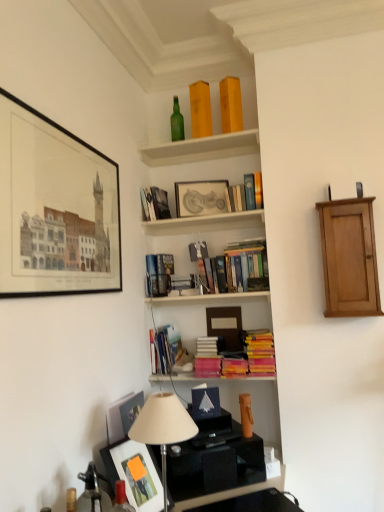
Question: Is matte yellow book at upper center, which ranks as the tenth book in bottom-to-top order, thinner than hardcover books at center, placed as the 1th book when sorted from bottom to top?

Choices:
 (A) yes
 (B) no

Answer: (A)

Question: Is matte yellow book at upper center, placed as the 1th book when sorted from top to bottom, to the left of hardcover books at center, placed as the tenth book when sorted from top to bottom, from the viewer's perspective?

Choices:
 (A) no
 (B) yes

Answer: (A)

Question: From the image's perspective, does matte yellow book at upper center, which ranks as the tenth book in bottom-to-top order, appear higher than hardcover books at center, placed as the tenth book when sorted from top to bottom?

Choices:
 (A) no
 (B) yes

Answer: (B)

Question: Considering the relative positions of matte yellow book at upper center, which ranks as the tenth book in bottom-to-top order, and hardcover books at center, placed as the 1th book when sorted from bottom to top, in the image provided, is matte yellow book at upper center, which ranks as the tenth book in bottom-to-top order, behind hardcover books at center, placed as the 1th book when sorted from bottom to top,?

Choices:
 (A) no
 (B) yes

Answer: (B)

Question: Is matte yellow book at upper center, placed as the 1th book when sorted from top to bottom, beside hardcover books at center, placed as the 1th book when sorted from bottom to top?

Choices:
 (A) no
 (B) yes

Answer: (A)

Question: Is there a large distance between matte yellow book at upper center, which ranks as the tenth book in bottom-to-top order, and hardcover books at center, placed as the 1th book when sorted from bottom to top?

Choices:
 (A) yes
 (B) no

Answer: (A)

Question: Considering the relative sizes of hardcover book at upper center, placed as the eighth book when sorted from bottom to top, and blue matte paper at center in the image provided, is hardcover book at upper center, placed as the eighth book when sorted from bottom to top, shorter than blue matte paper at center?

Choices:
 (A) yes
 (B) no

Answer: (B)

Question: Is the position of hardcover book at upper center, placed as the eighth book when sorted from bottom to top, more distant than that of blue matte paper at center?

Choices:
 (A) yes
 (B) no

Answer: (A)

Question: Is hardcover book at upper center, placed as the eighth book when sorted from bottom to top, aimed at blue matte paper at center?

Choices:
 (A) yes
 (B) no

Answer: (B)

Question: From a real-world perspective, is hardcover book at upper center, placed as the third book when sorted from top to bottom, located beneath blue matte paper at center?

Choices:
 (A) yes
 (B) no

Answer: (B)

Question: Would you say hardcover book at upper center, placed as the eighth book when sorted from bottom to top, contains blue matte paper at center?

Choices:
 (A) no
 (B) yes

Answer: (A)

Question: From a real-world perspective, is hardcover book at upper center, placed as the third book when sorted from top to bottom, over blue matte paper at center?

Choices:
 (A) yes
 (B) no

Answer: (A)

Question: Is hardcover books at center, which is counted as the ninth book, starting from the top, thinner than matte black picture frame at upper left, the 1th picture frame viewed from the left?

Choices:
 (A) no
 (B) yes

Answer: (A)